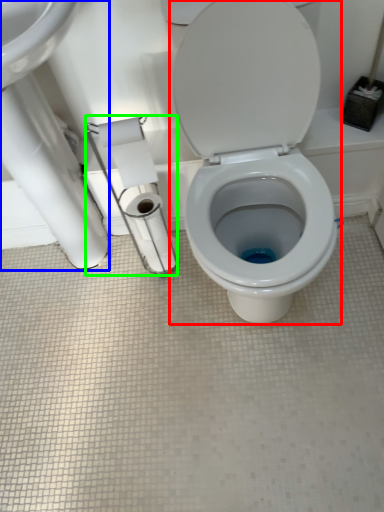
Question: Which is nearer to the toilet (highlighted by a red box)? sink (highlighted by a blue box) or toilet paper (highlighted by a green box).

Choices:
 (A) sink
 (B) toilet paper

Answer: (B)